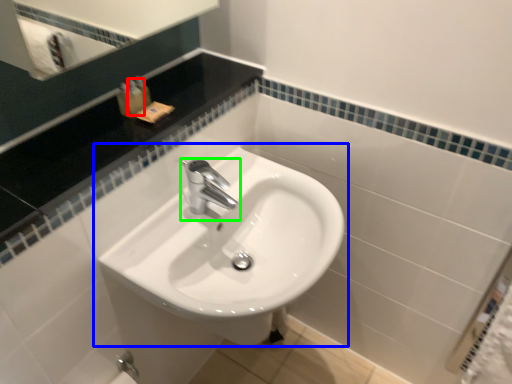
Question: Estimate the real-world distances between objects in this image. Which object is closer to toiletry (highlighted by a red box), sink (highlighted by a blue box) or tap (highlighted by a green box)?

Choices:
 (A) sink
 (B) tap

Answer: (B)